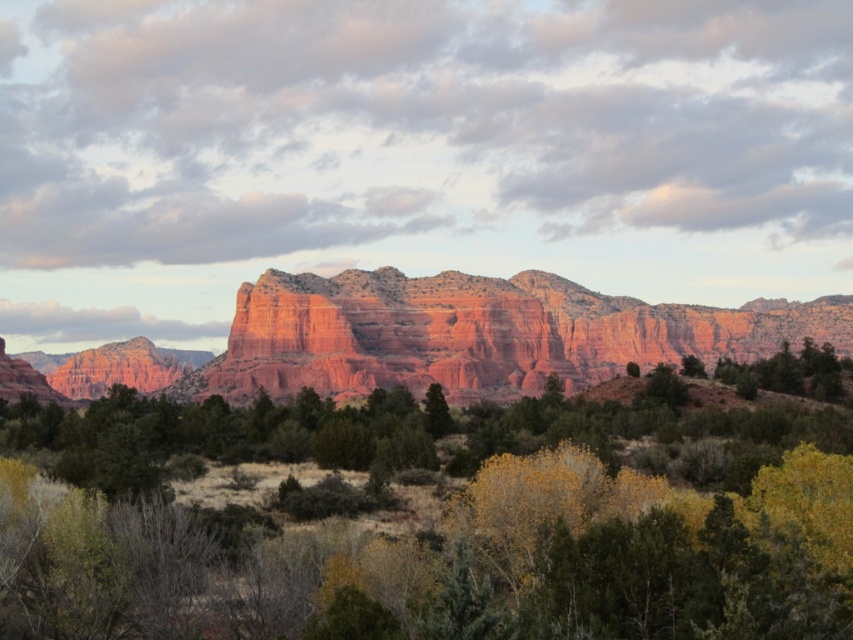
You are an environmental scientist assessing the landscape. You observe the green leafy tree at center and the rustic sandstone mountain at center. Which object is taller?

The rustic sandstone mountain at center is taller than the green leafy tree at center.

You are an environmental scientist studying the landscape. You observe the green leafy tree at center and the rustic sandstone mountain at center. Which object is closer to the ground?

The green leafy tree at center is closer to the ground because it is positioned under the rustic sandstone mountain at center.